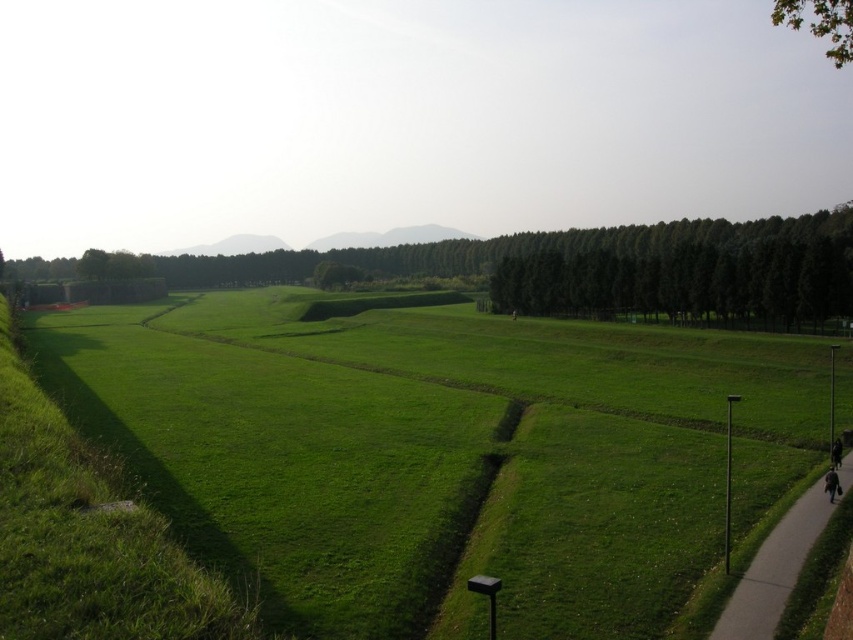
Is green leafy tree at upper right to the left of dark brown leather jacket at lower right from the viewer's perspective?

In fact, green leafy tree at upper right is to the right of dark brown leather jacket at lower right.

Is green leafy tree at upper right further to the viewer compared to dark brown leather jacket at lower right?

No.

Where is `green leafy tree at upper right`? green leafy tree at upper right is located at coordinates (820, 22).

Locate an element on the screen. green leafy tree at upper right is located at coordinates (820, 22).

Can you confirm if gray concrete sidewalk at lower right is positioned below dark brown leather jacket at lower right?

Yes.

Which is more to the left, gray concrete sidewalk at lower right or dark brown leather jacket at lower right?

Positioned to the left is gray concrete sidewalk at lower right.

Identify the location of gray concrete sidewalk at lower right. This screenshot has width=853, height=640. (775, 570).

Between green leafy tree at upper right and black fabric person at lower right, which one appears on the right side from the viewer's perspective?

green leafy tree at upper right is more to the right.

Is green leafy tree at upper right taller than black fabric person at lower right?

Correct, green leafy tree at upper right is much taller as black fabric person at lower right.

Locate an element on the screen. The width and height of the screenshot is (853, 640). green leafy tree at upper right is located at coordinates (820, 22).